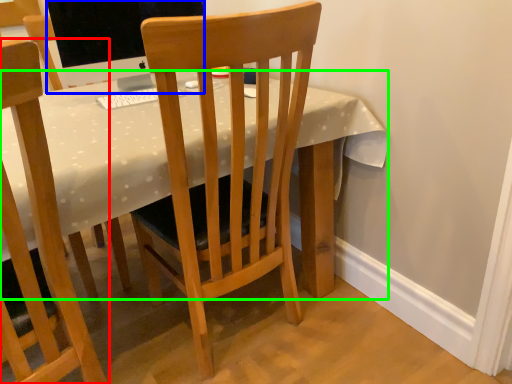
Question: Which object is the closest to the chair (highlighted by a red box)? Choose among these: television (highlighted by a blue box) or desk (highlighted by a green box).

Choices:
 (A) television
 (B) desk

Answer: (B)